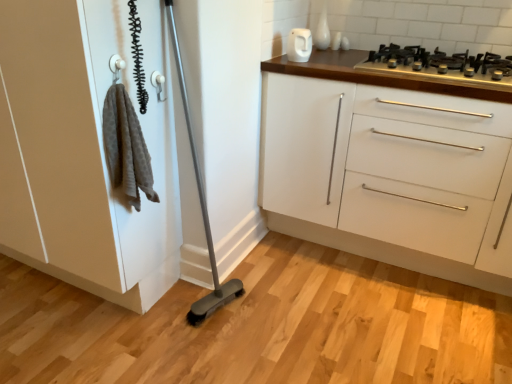
Image resolution: width=512 pixels, height=384 pixels. In order to click on free space in front of white matte cabinet at left in this screenshot , I will do `click(54, 338)`.